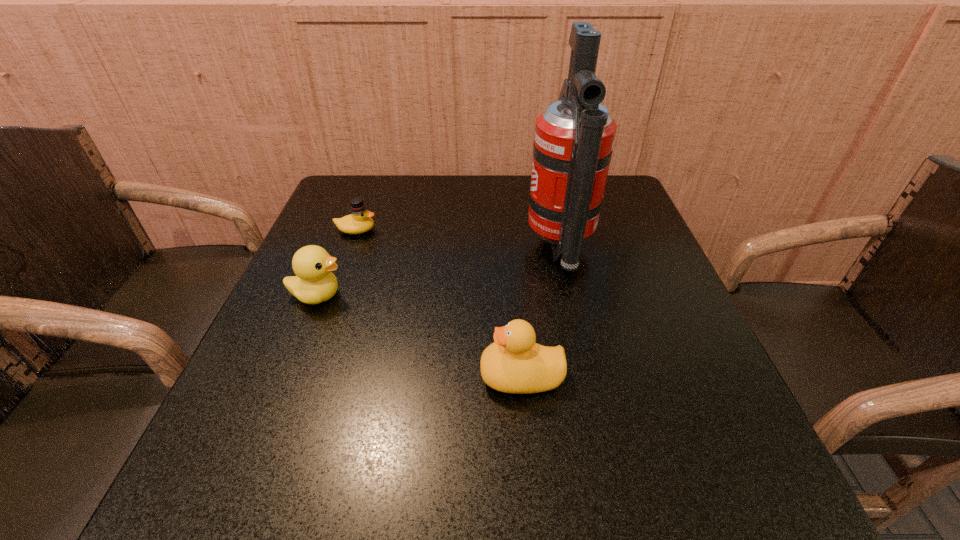
Where is `free space located 0.070m on the face of the rightmost duck`? Image resolution: width=960 pixels, height=540 pixels. free space located 0.070m on the face of the rightmost duck is located at coordinates (440, 376).

This screenshot has width=960, height=540. Identify the location of vacant space located on the face of the rightmost duck. (375, 376).

Where is `vacant region located on the face of the second nearest duck`? Image resolution: width=960 pixels, height=540 pixels. vacant region located on the face of the second nearest duck is located at coordinates (447, 295).

Locate an element on the screen. The height and width of the screenshot is (540, 960). free location located on the front-facing side of the farthest duck is located at coordinates (532, 230).

What are the coordinates of `object at the far edge` in the screenshot? It's located at (574, 136).

Find the location of a particular element. object present at the right edge is located at coordinates (574, 136).

The image size is (960, 540). Find the location of `object that is at the far right corner`. object that is at the far right corner is located at coordinates (574, 136).

The image size is (960, 540). I want to click on free space at the far edge, so click(x=403, y=193).

In the image, there is a desktop. Find the location of `vacant space at the near edge`. vacant space at the near edge is located at coordinates [472, 467].

At what (x,y) coordinates should I click in order to perform the action: click on vacant space at the left edge. Please return your answer as a coordinate pair (x, y). Image resolution: width=960 pixels, height=540 pixels. Looking at the image, I should click on (348, 303).